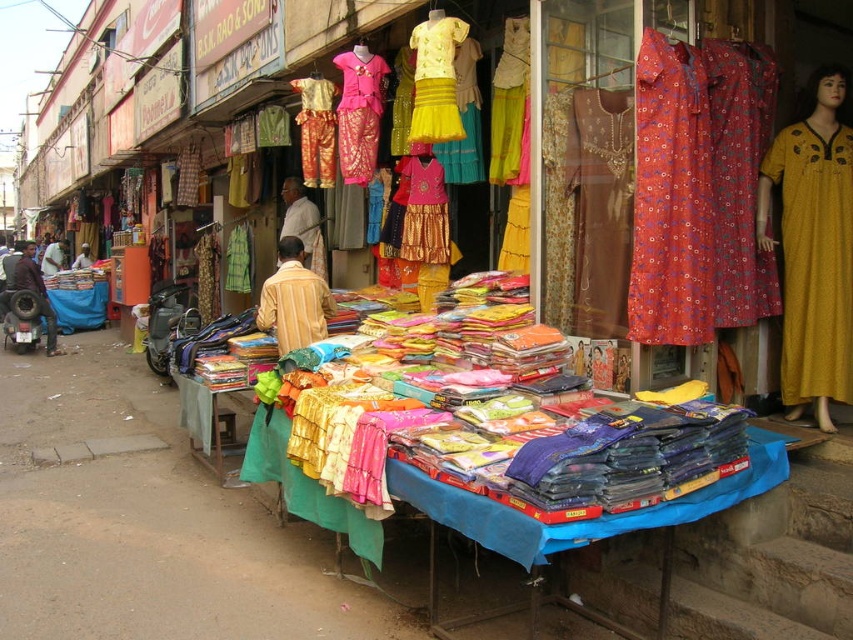
Is shiny gold skirt at center behind green fabric at center?

No, shiny gold skirt at center is in front of green fabric at center.

Who is positioned more to the right, shiny gold skirt at center or green fabric at center?

Positioned to the right is shiny gold skirt at center.

I want to click on shiny gold skirt at center, so click(x=424, y=212).

Where is `shiny gold skirt at center`? The height and width of the screenshot is (640, 853). shiny gold skirt at center is located at coordinates (424, 212).

Does shiny gold skirt at center have a smaller size compared to matte yellow fabric at center?

Yes, shiny gold skirt at center is smaller than matte yellow fabric at center.

Is shiny gold skirt at center to the left of matte yellow fabric at center from the viewer's perspective?

In fact, shiny gold skirt at center is to the right of matte yellow fabric at center.

What do you see at coordinates (424, 212) in the screenshot? Image resolution: width=853 pixels, height=640 pixels. I see `shiny gold skirt at center` at bounding box center [424, 212].

Locate an element on the screen. The width and height of the screenshot is (853, 640). shiny gold skirt at center is located at coordinates (424, 212).

Between floral red dress at center and green fabric at center, which one appears on the left side from the viewer's perspective?

green fabric at center is more to the left.

Which of these two, floral red dress at center or green fabric at center, stands taller?

floral red dress at center is taller.

Find the location of a particular element. This screenshot has height=640, width=853. floral red dress at center is located at coordinates (670, 198).